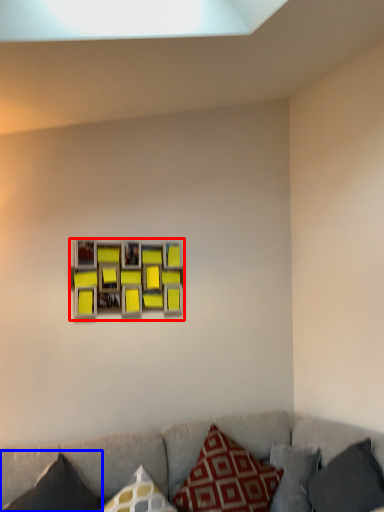
Question: Among these objects, which one is nearest to the camera, picture frame (highlighted by a red box) or pillow (highlighted by a blue box)?

Choices:
 (A) picture frame
 (B) pillow

Answer: (B)